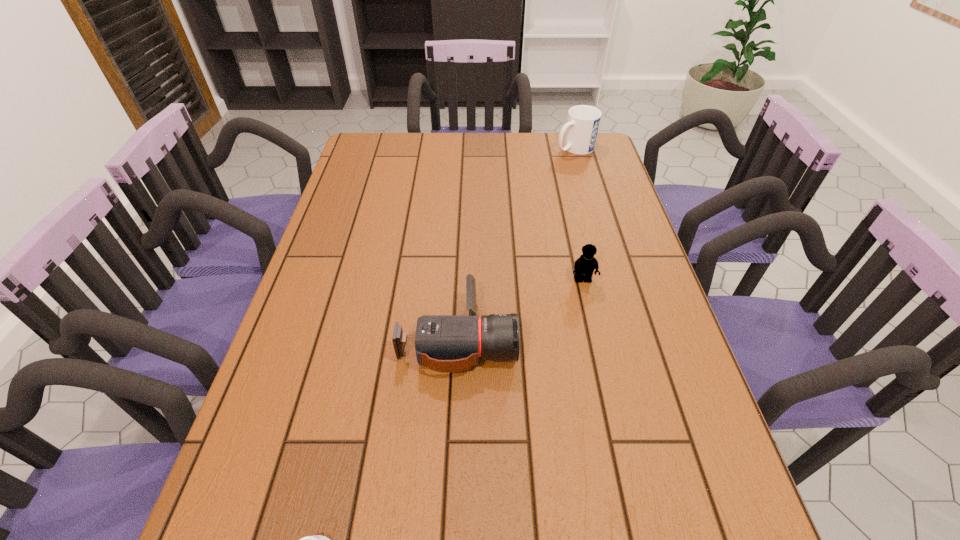
Select which object is the closest to the nearest object. Please provide its 2D coordinates. Your answer should be formatted as a tuple, i.e. [(x, y)], where the tuple contains the x and y coordinates of a point satisfying the conditions above.

[(444, 343)]

You are a GUI agent. You are given a task and a screenshot of the screen. Output one action in this format:
    pyautogui.click(x=<x>, y=<y>)
    Task: Click on the blank space that satisfies the following two spatial constraints: 1. on the front-facing side of the Lego; 2. on the lens of the third farthest object
    This screenshot has height=540, width=960.
    Given the screenshot: What is the action you would take?
    pyautogui.click(x=595, y=337)

Identify the location of free location that satisfies the following two spatial constraints: 1. on the front-facing side of the Lego; 2. on the lens of the camcorder. This screenshot has height=540, width=960. (595, 337).

Where is `free space that satisfies the following two spatial constraints: 1. on the front side of the mug; 2. on the lens of the camcorder`? This screenshot has width=960, height=540. free space that satisfies the following two spatial constraints: 1. on the front side of the mug; 2. on the lens of the camcorder is located at coordinates tap(629, 337).